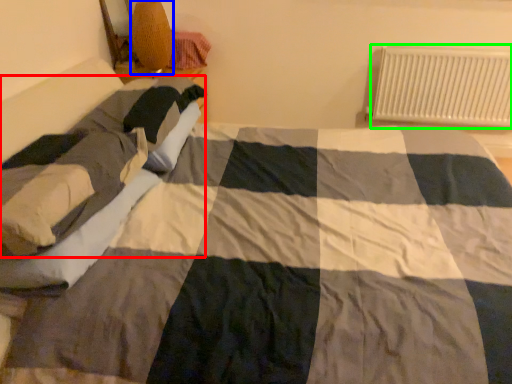
Question: Which object is positioned farthest from person (highlighted by a red box)? Select from lamp (highlighted by a blue box) and radiator (highlighted by a green box).

Choices:
 (A) lamp
 (B) radiator

Answer: (B)